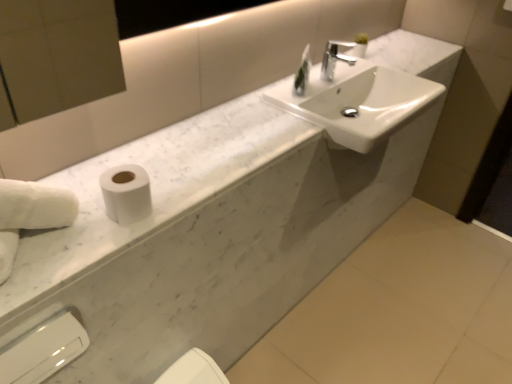
Where is `free space to the back side of white fluffy hand towel at left`? This screenshot has height=384, width=512. free space to the back side of white fluffy hand towel at left is located at coordinates (77, 180).